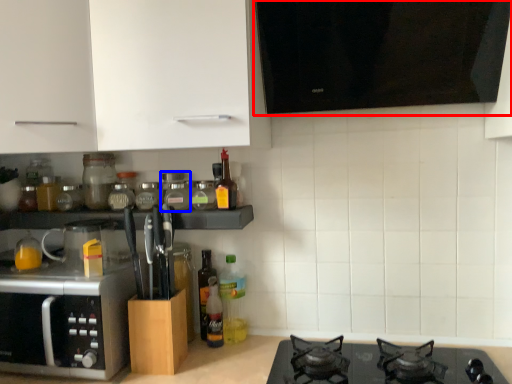
Question: Which point is further to the camera, vent (highlighted by a red box) or glass jar (highlighted by a blue box)?

Choices:
 (A) vent
 (B) glass jar

Answer: (B)